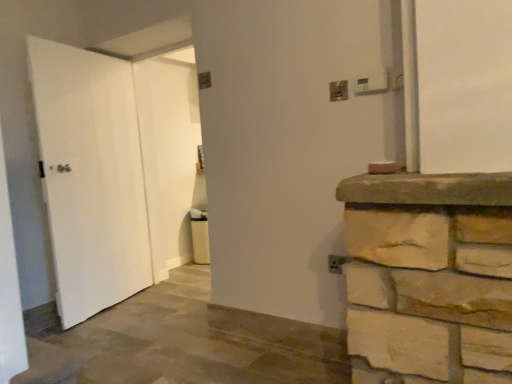
Question: Is metallic silver electric outlet at upper center, which is counted as the 1th electric outlet, starting from the left, wider than metallic silver electric outlet at upper right, the second electric outlet when ordered from back to front?

Choices:
 (A) no
 (B) yes

Answer: (A)

Question: Is metallic silver electric outlet at upper center, which is counted as the 1th electric outlet, starting from the left, oriented towards metallic silver electric outlet at upper right, acting as the second electric outlet starting from the left?

Choices:
 (A) no
 (B) yes

Answer: (A)

Question: From a real-world perspective, is metallic silver electric outlet at upper center, which is counted as the second electric outlet, starting from the front, on top of metallic silver electric outlet at upper right, the 1th electric outlet viewed from the right?

Choices:
 (A) no
 (B) yes

Answer: (A)

Question: Is metallic silver electric outlet at upper center, the first electric outlet from the back, bigger than metallic silver electric outlet at upper right, the 1th electric outlet viewed from the right?

Choices:
 (A) no
 (B) yes

Answer: (A)

Question: Does metallic silver electric outlet at upper center, which is counted as the second electric outlet, starting from the right, appear on the right side of metallic silver electric outlet at upper right, acting as the second electric outlet starting from the left?

Choices:
 (A) yes
 (B) no

Answer: (B)

Question: Considering the positions of white matte door at left, which is the 2th door from right to left, and metallic silver electric outlet at upper right, the 1th electric outlet viewed from the right, in the image, is white matte door at left, which is the 2th door from right to left, wider or thinner than metallic silver electric outlet at upper right, the 1th electric outlet viewed from the right,?

Choices:
 (A) thin
 (B) wide

Answer: (B)

Question: From a real-world perspective, is white matte door at left, positioned as the 1th door in left-to-right order, physically located above or below metallic silver electric outlet at upper right, the second electric outlet when ordered from back to front?

Choices:
 (A) below
 (B) above

Answer: (A)

Question: Is point (47, 152) positioned closer to the camera than point (385, 82)?

Choices:
 (A) closer
 (B) farther

Answer: (B)

Question: From the image's perspective, relative to metallic silver electric outlet at upper right, positioned as the first electric outlet in front-to-back order, is white matte door at left, positioned as the 1th door in left-to-right order, above or below?

Choices:
 (A) below
 (B) above

Answer: (A)

Question: Considering the positions of white matte door at center, the 1th door positioned from the right, and metallic silver electric outlet at upper right, acting as the second electric outlet starting from the left, in the image, is white matte door at center, the 1th door positioned from the right, wider or thinner than metallic silver electric outlet at upper right, acting as the second electric outlet starting from the left,?

Choices:
 (A) thin
 (B) wide

Answer: (B)

Question: From the image's perspective, relative to metallic silver electric outlet at upper right, acting as the second electric outlet starting from the left, is white matte door at center, positioned as the second door in left-to-right order, above or below?

Choices:
 (A) above
 (B) below

Answer: (B)

Question: Is white matte door at center, the 1th door positioned from the right, bigger or smaller than metallic silver electric outlet at upper right, positioned as the first electric outlet in front-to-back order?

Choices:
 (A) small
 (B) big

Answer: (B)

Question: From a real-world perspective, is white matte door at center, positioned as the second door in left-to-right order, physically located above or below metallic silver electric outlet at upper right, the second electric outlet when ordered from back to front?

Choices:
 (A) below
 (B) above

Answer: (A)

Question: Considering the positions of white matte door at left, positioned as the 1th door in left-to-right order, and white matte door at center, positioned as the second door in left-to-right order, in the image, is white matte door at left, positioned as the 1th door in left-to-right order, taller or shorter than white matte door at center, positioned as the second door in left-to-right order,?

Choices:
 (A) tall
 (B) short

Answer: (B)

Question: From the image's perspective, is white matte door at left, which is the 2th door from right to left, above or below white matte door at center, the 1th door positioned from the right?

Choices:
 (A) above
 (B) below

Answer: (B)